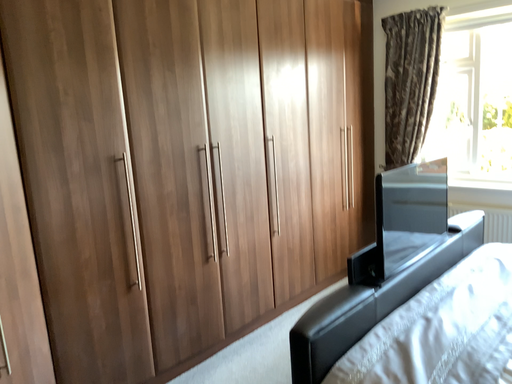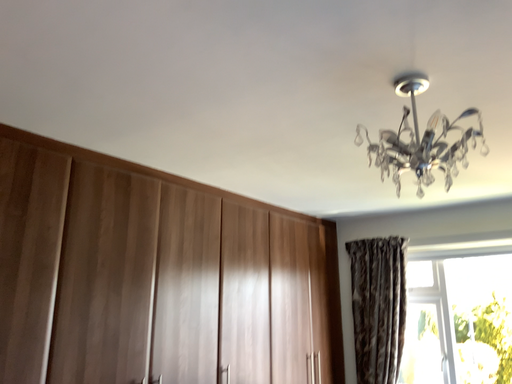
Question: How did the camera likely rotate when shooting the video?

Choices:
 (A) rotated upward
 (B) rotated downward

Answer: (A)